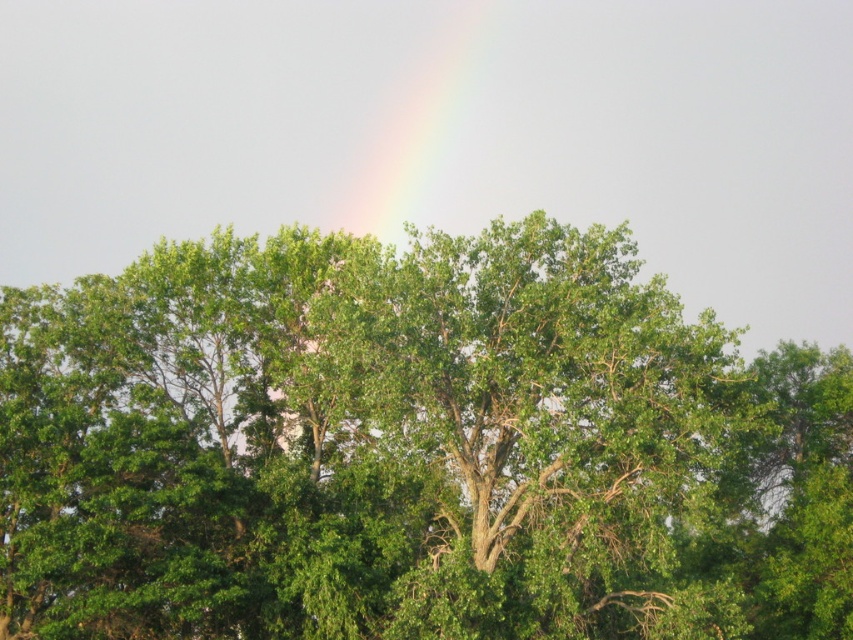
Does green leafy tree at center appear on the left side of rainbow at upper center?

Incorrect, green leafy tree at center is not on the left side of rainbow at upper center.

Who is taller, green leafy tree at center or rainbow at upper center?

With more height is green leafy tree at center.

Is point (418, 544) behind point (334, 208)?

No, it is not.

Where is `green leafy tree at center`? The image size is (853, 640). green leafy tree at center is located at coordinates (412, 449).